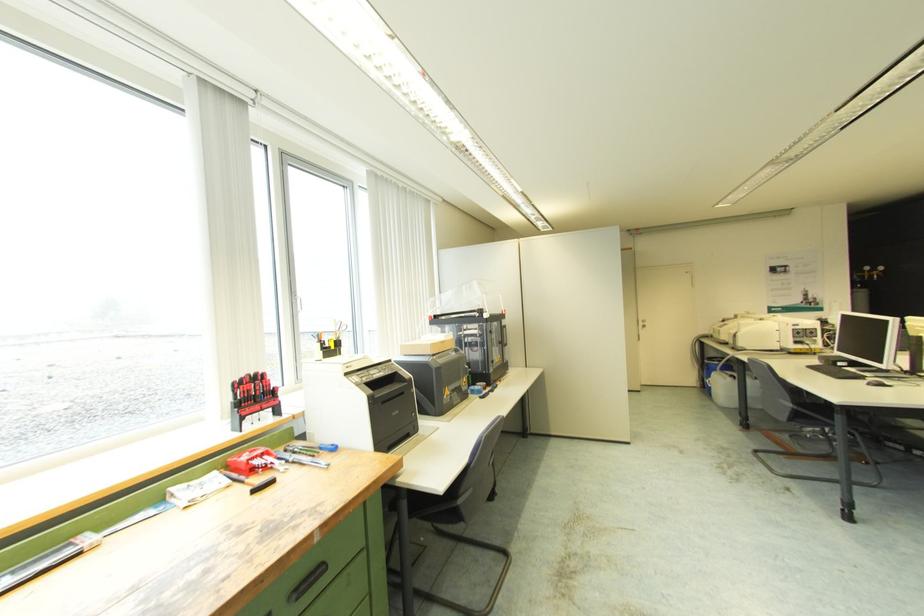
The location [733,389] corresponds to which object?

It corresponds to the white plastic canister in the image.